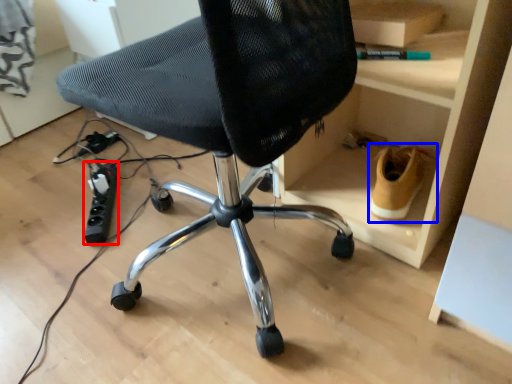
Question: Which object appears farthest to the camera in this image, plug (highlighted by a red box) or footwear (highlighted by a blue box)?

Choices:
 (A) plug
 (B) footwear

Answer: (A)